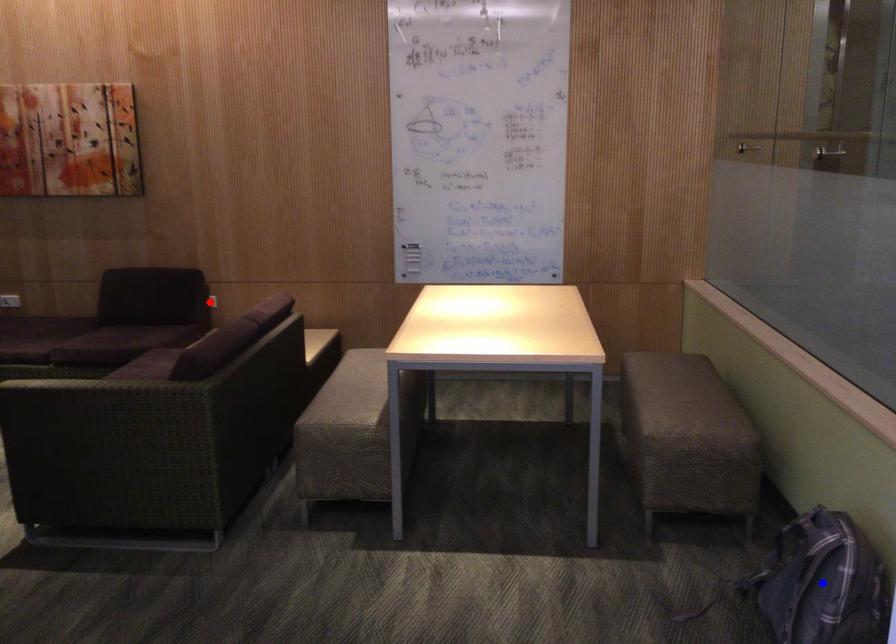
Question: Two points are marked on the image. Which point is closer to the camera?

Choices:
 (A) Blue point is closer.
 (B) Red point is closer.

Answer: (A)